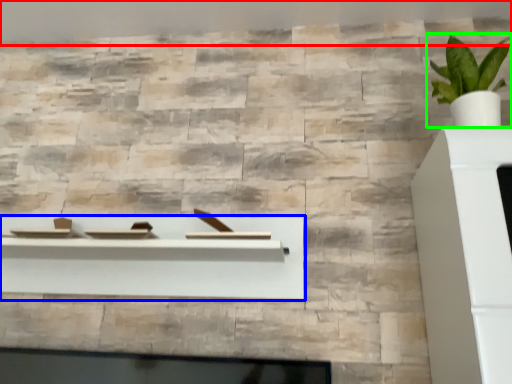
Question: Which object is positioned farthest from backdrop (highlighted by a red box)? Select from shelf (highlighted by a blue box) and houseplant (highlighted by a green box).

Choices:
 (A) shelf
 (B) houseplant

Answer: (A)